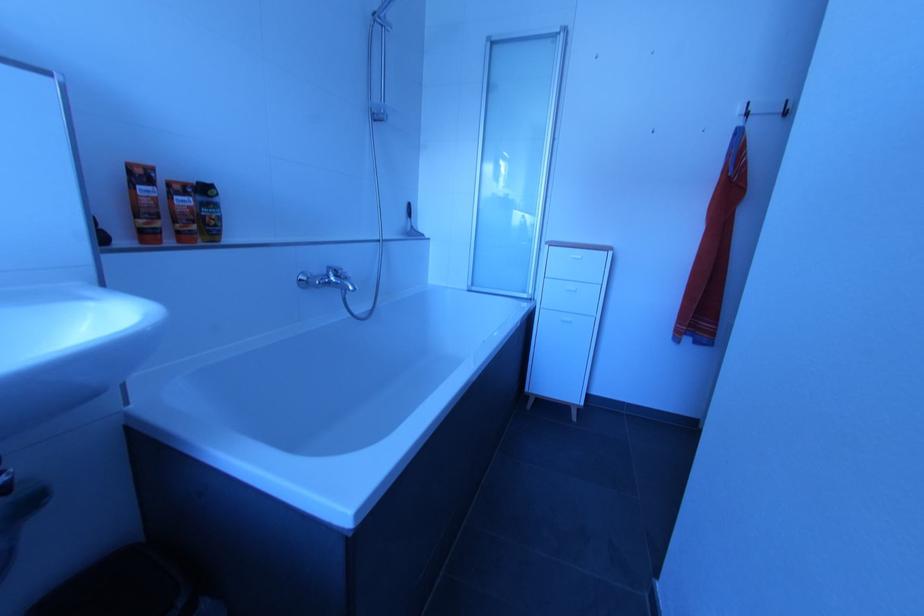
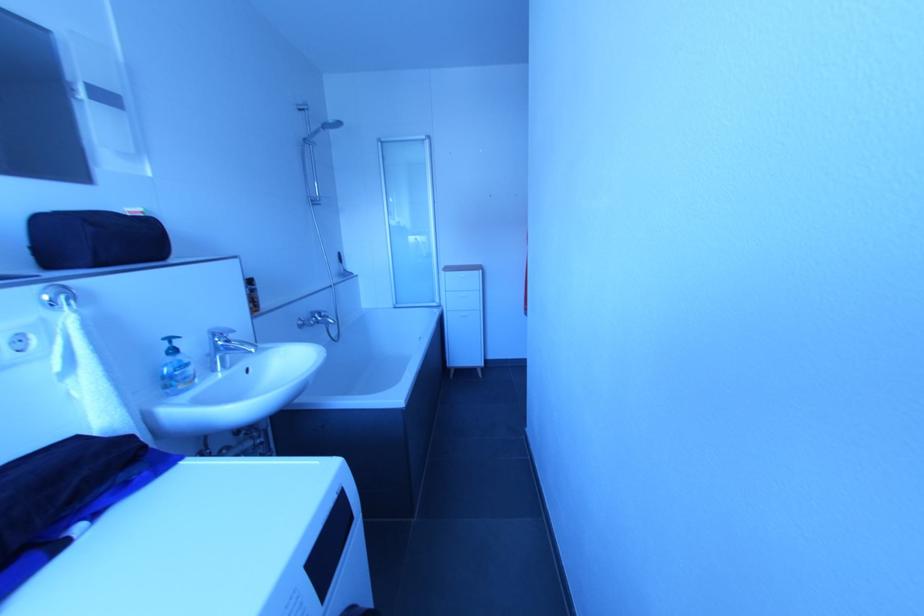
Question: In a continuous first-person perspective shot, in which direction is the camera moving?

Choices:
 (A) Left
 (B) Right
 (C) Forward
 (D) Backward

Answer: (D)